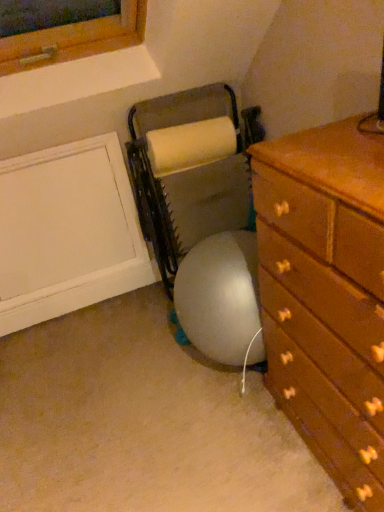
Question: Is gray fabric bean bag chair at center bigger or smaller than wooden chest of drawers at lower right?

Choices:
 (A) big
 (B) small

Answer: (B)

Question: In terms of width, does gray fabric bean bag chair at center look wider or thinner when compared to wooden chest of drawers at lower right?

Choices:
 (A) wide
 (B) thin

Answer: (B)

Question: Is gray fabric bean bag chair at center to the left or to the right of wooden chest of drawers at lower right in the image?

Choices:
 (A) right
 (B) left

Answer: (B)

Question: From the image's perspective, relative to gray fabric bean bag chair at center, is wooden chest of drawers at lower right above or below?

Choices:
 (A) above
 (B) below

Answer: (B)

Question: In the image, is wooden chest of drawers at lower right positioned in front of or behind gray fabric bean bag chair at center?

Choices:
 (A) front
 (B) behind

Answer: (A)

Question: From a real-world perspective, is wooden chest of drawers at lower right above or below gray fabric bean bag chair at center?

Choices:
 (A) below
 (B) above

Answer: (A)

Question: Is wooden chest of drawers at lower right taller or shorter than gray fabric bean bag chair at center?

Choices:
 (A) short
 (B) tall

Answer: (B)